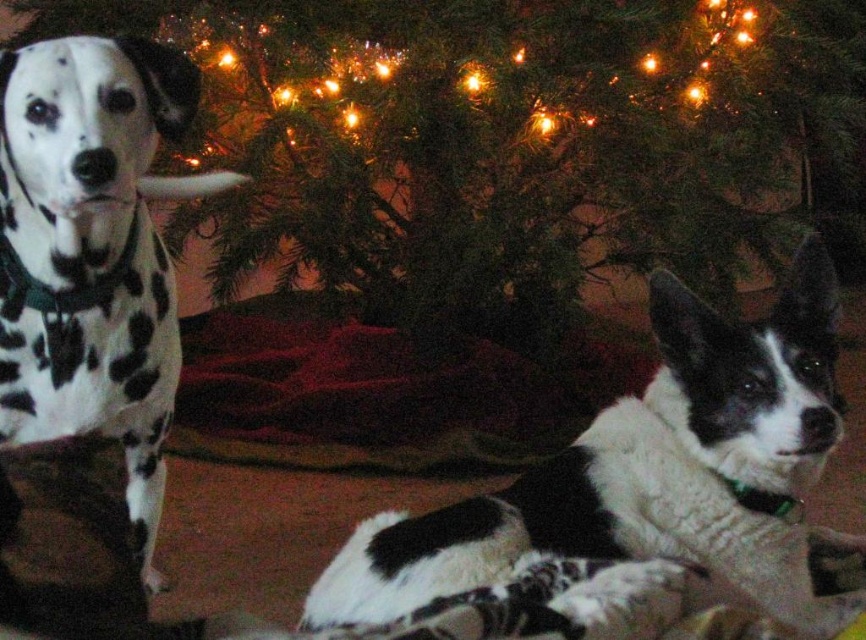
Which is in front, point (596, 554) or point (141, 196)?

Point (596, 554)

Is point (624, 540) more distant than point (171, 385)?

That is False.

Is point (787, 596) positioned before point (66, 314)?

No, it is not.

What are the coordinates of `black and white fur at lower right` in the screenshot? It's located at [x=653, y=472].

Who is more distant from viewer, (263, 218) or (179, 365)?

The point (263, 218) is more distant.

Between green textured christmas tree at center and spotted fur dog at left, which one appears on the right side from the viewer's perspective?

From the viewer's perspective, green textured christmas tree at center appears more on the right side.

Is point (509, 20) positioned behind point (94, 291)?

Yes, point (509, 20) is behind point (94, 291).

Locate an element on the screen. The image size is (866, 640). green textured christmas tree at center is located at coordinates (532, 140).

Looking at this image, can you confirm if green textured christmas tree at center is bigger than black and white fur at lower right?

Indeed, green textured christmas tree at center has a larger size compared to black and white fur at lower right.

Can you confirm if green textured christmas tree at center is shorter than black and white fur at lower right?

In fact, green textured christmas tree at center may be taller than black and white fur at lower right.

What do you see at coordinates (532, 140) in the screenshot? I see `green textured christmas tree at center` at bounding box center [532, 140].

The width and height of the screenshot is (866, 640). What are the coordinates of `green textured christmas tree at center` in the screenshot? It's located at (532, 140).